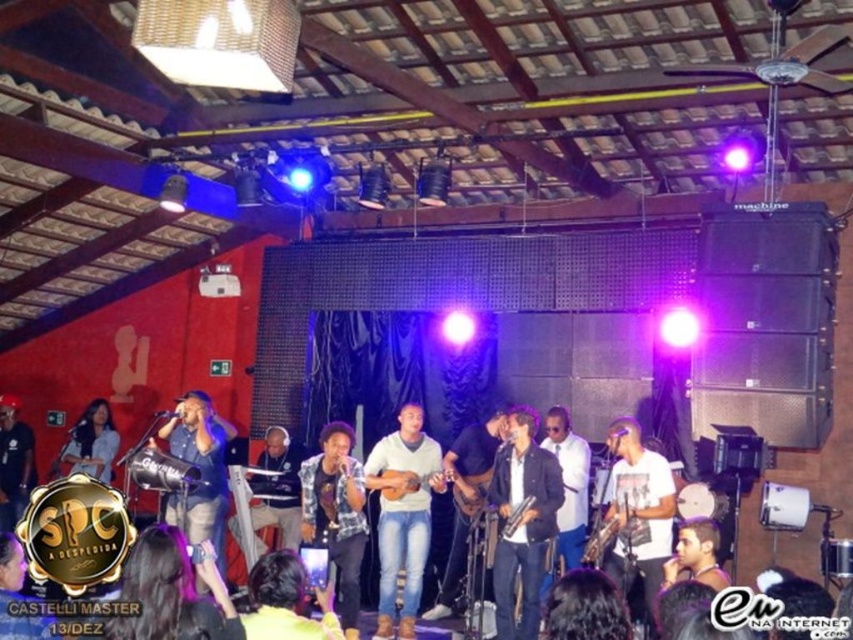
Is point (426, 554) closer to viewer compared to point (103, 426)?

That is True.

Based on the photo, is white matte sweater at center smaller than matte black guitar at left?

Actually, white matte sweater at center might be larger than matte black guitar at left.

Does point (402, 481) lie in front of point (65, 445)?

Yes, point (402, 481) is closer to viewer.

Identify the location of white matte sweater at center. The height and width of the screenshot is (640, 853). (402, 516).

Does plaid shirt at center appear on the right side of wooden acoustic guitar at center?

Incorrect, plaid shirt at center is not on the right side of wooden acoustic guitar at center.

Looking at this image, does plaid shirt at center have a larger size compared to wooden acoustic guitar at center?

Indeed, plaid shirt at center has a larger size compared to wooden acoustic guitar at center.

Does point (341, 627) come closer to viewer compared to point (381, 490)?

Yes, it is.

Identify the location of plaid shirt at center. This screenshot has width=853, height=640. (x=335, y=513).

How distant is matte black guitar at left from metallic silver drum at center?

matte black guitar at left and metallic silver drum at center are 8.91 feet apart.

Between matte black guitar at left and metallic silver drum at center, which one has less height?

With less height is metallic silver drum at center.

Which is in front, point (99, 419) or point (178, 461)?

Point (178, 461)

Where is `matte black guitar at left`? This screenshot has width=853, height=640. matte black guitar at left is located at coordinates (91, 442).